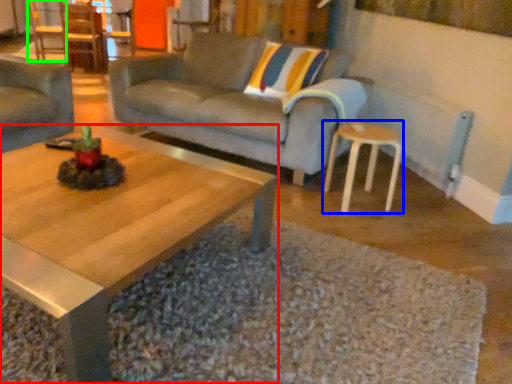
Question: Which object is positioned closest to coffee table (highlighted by a red box)? Select from stool (highlighted by a blue box) and chair (highlighted by a green box).

Choices:
 (A) stool
 (B) chair

Answer: (A)